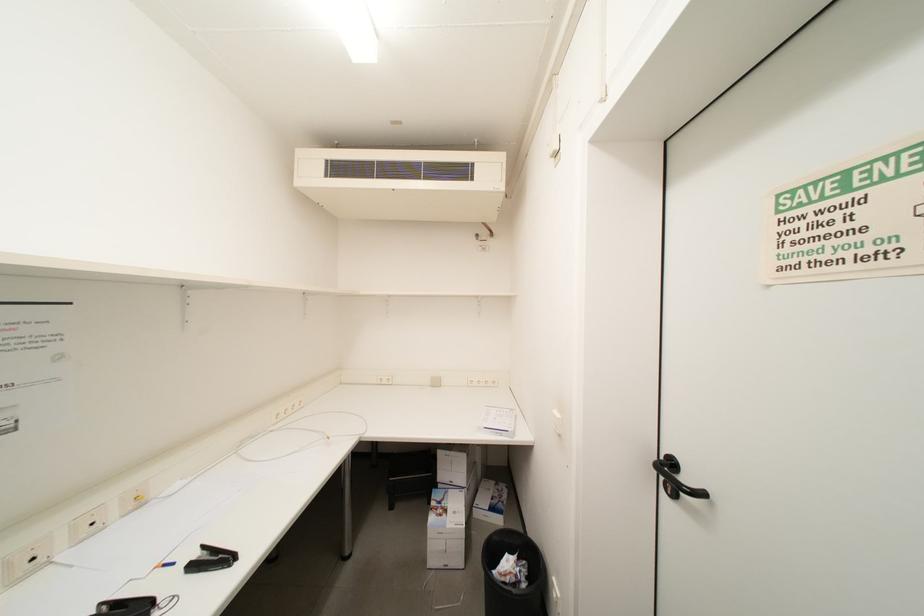
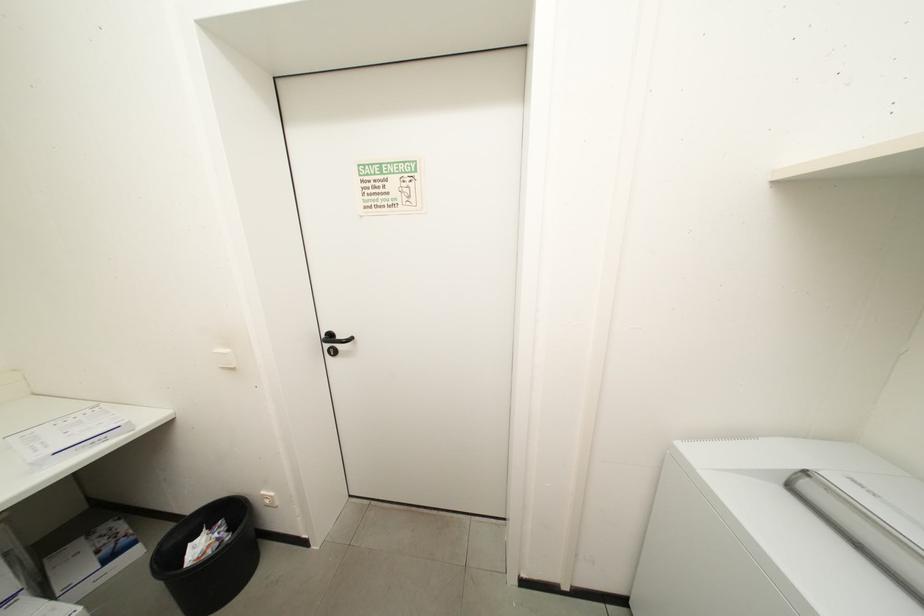
Based on the continuous images, in which direction is the camera rotating?

The camera's rotation is toward right-down.